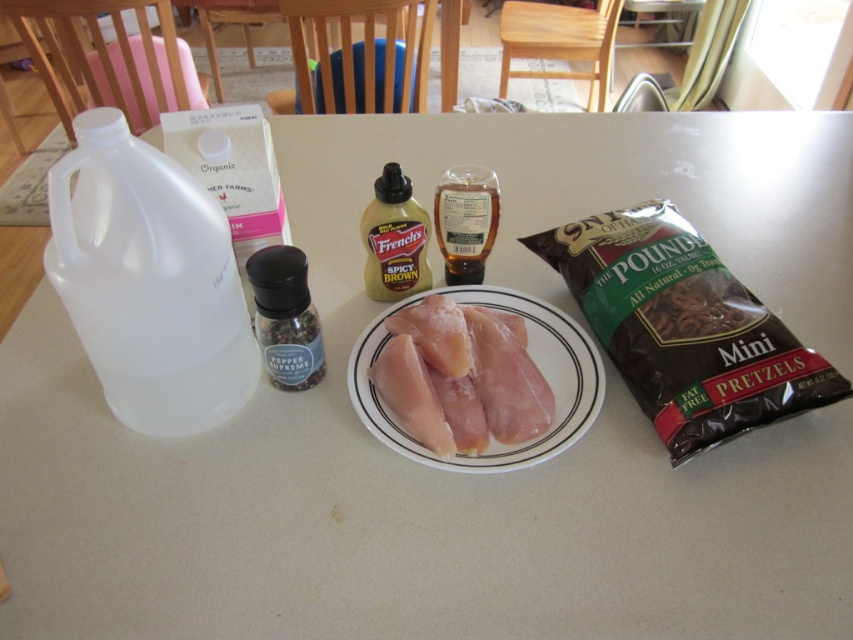
Who is positioned more to the left, transparent plastic jug at left or white ceramic plate at center?

From the viewer's perspective, transparent plastic jug at left appears more on the left side.

Between transparent plastic jug at left and white ceramic plate at center, which one is positioned lower?

white ceramic plate at center

The height and width of the screenshot is (640, 853). I want to click on transparent plastic jug at left, so click(148, 282).

Can you confirm if white ceramic plate at center is positioned to the right of translucent plastic bottle of french's spicy brown mustard at center?

Indeed, white ceramic plate at center is positioned on the right side of translucent plastic bottle of french's spicy brown mustard at center.

From the picture: Is white ceramic plate at center positioned in front of translucent plastic bottle of french's spicy brown mustard at center?

Yes, it is.

Describe the element at coordinates (532, 358) in the screenshot. The image size is (853, 640). I see `white ceramic plate at center` at that location.

At what (x,y) coordinates should I click in order to perform the action: click on white ceramic plate at center. Please return your answer as a coordinate pair (x, y). The height and width of the screenshot is (640, 853). Looking at the image, I should click on (532, 358).

Between white ceramic plate at center and translucent plastic bottle at center, which one appears on the right side from the viewer's perspective?

From the viewer's perspective, white ceramic plate at center appears more on the right side.

Does white ceramic plate at center have a lesser height compared to translucent plastic bottle at center?

No, white ceramic plate at center is not shorter than translucent plastic bottle at center.

Is point (363, 355) in front of point (445, 260)?

Yes, point (363, 355) is in front of point (445, 260).

This screenshot has height=640, width=853. I want to click on white ceramic plate at center, so pyautogui.click(x=532, y=358).